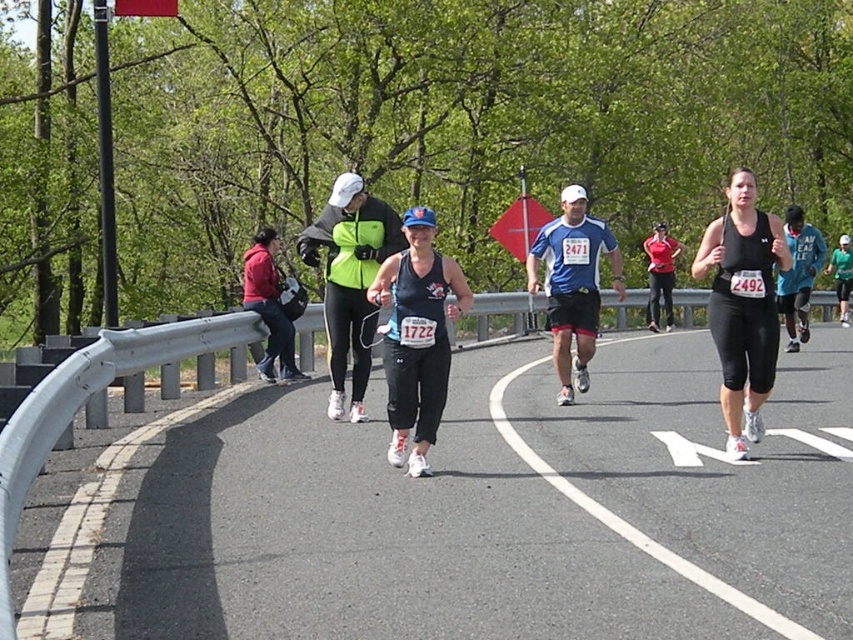
Question: Which point is closer to the camera taking this photo?

Choices:
 (A) (616, 260)
 (B) (718, 330)

Answer: (B)

Question: Is neon green fabric at center below matte red tank top at center?

Choices:
 (A) yes
 (B) no

Answer: (B)

Question: Among these points, which one is farthest from the camera?

Choices:
 (A) coord(653,269)
 (B) coord(392,272)

Answer: (A)

Question: Estimate the real-world distances between objects in this image. Which object is farther from the neon green fabric at center?

Choices:
 (A) matte red hoodie at center
 (B) matte red tank top at center

Answer: (B)

Question: Does blue fabric shirt at center have a smaller size compared to teal fabric shirt at right?

Choices:
 (A) yes
 (B) no

Answer: (A)

Question: Is blue fabric shirt at center thinner than matte red tank top at center?

Choices:
 (A) no
 (B) yes

Answer: (A)